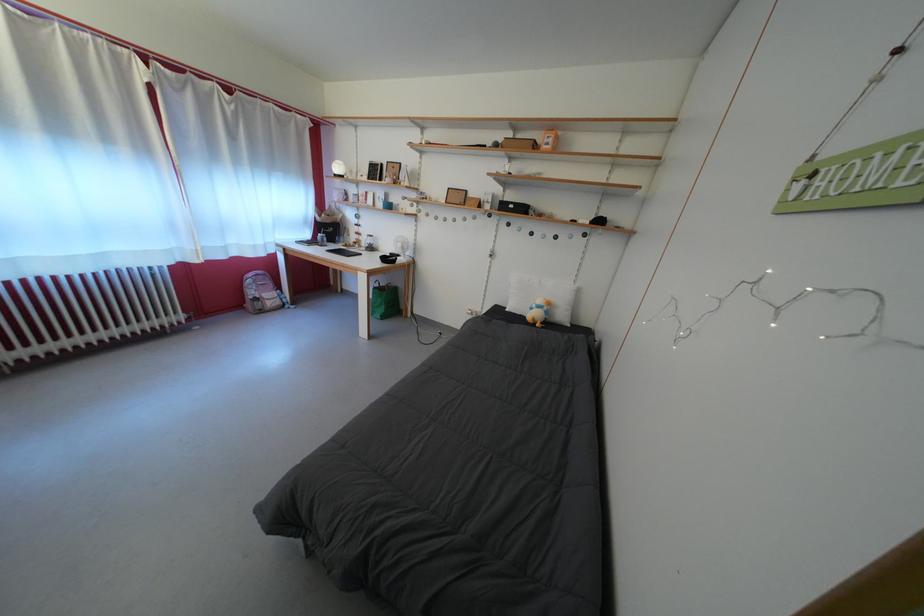
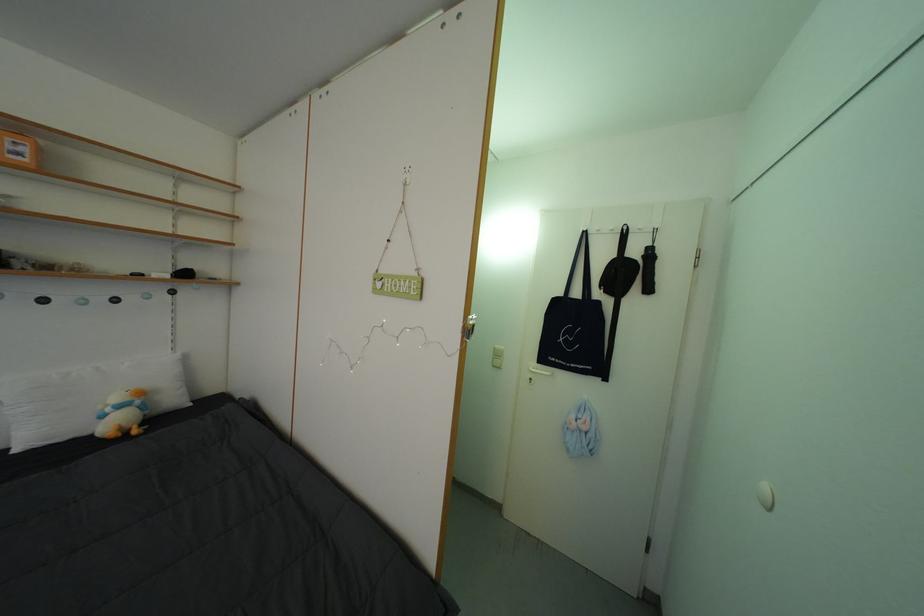
Question: How did the camera likely rotate?

Choices:
 (A) Left
 (B) Right
 (C) Up
 (D) Down

Answer: (B)